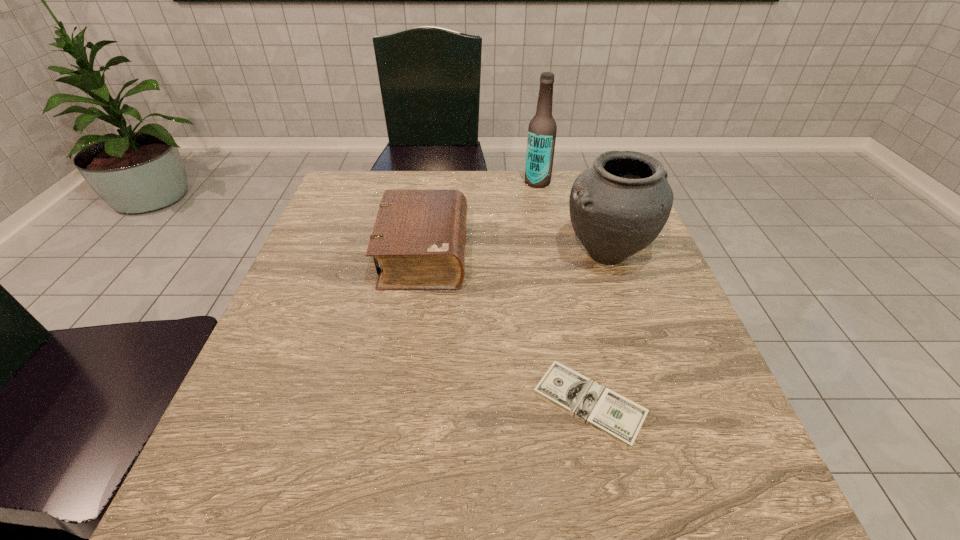
Where is `vacant space located 0.090m on the front of the urn`? The height and width of the screenshot is (540, 960). vacant space located 0.090m on the front of the urn is located at coordinates (629, 316).

What are the coordinates of `free space located on the spine side of the leftmost object` in the screenshot? It's located at (511, 254).

The image size is (960, 540). Identify the location of free space located on the right of the dollar. (686, 404).

Where is `object that is at the far edge`? This screenshot has width=960, height=540. object that is at the far edge is located at coordinates (542, 129).

At what (x,y) coordinates should I click in order to perform the action: click on urn that is at the right edge. Please return your answer as a coordinate pair (x, y). This screenshot has width=960, height=540. Looking at the image, I should click on (618, 206).

The image size is (960, 540). I want to click on dollar that is at the right edge, so click(615, 416).

Locate an element on the screen. free space at the far edge of the desktop is located at coordinates (504, 187).

In order to click on blank space at the left edge in this screenshot , I will do `click(288, 355)`.

You are a GUI agent. You are given a task and a screenshot of the screen. Output one action in this format:
    pyautogui.click(x=<x>, y=<y>)
    Task: Click on the free region at the right edge of the desktop
    
    Given the screenshot: What is the action you would take?
    pyautogui.click(x=602, y=308)

Where is `vacant space at the far left corner of the desktop`? vacant space at the far left corner of the desktop is located at coordinates (362, 218).